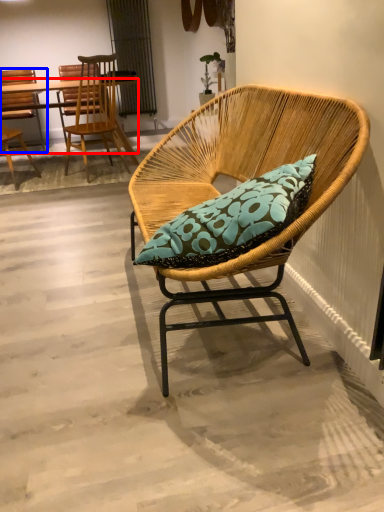
Question: Among these objects, which one is farthest to the camera, desk (highlighted by a red box) or chair (highlighted by a blue box)?

Choices:
 (A) desk
 (B) chair

Answer: (B)